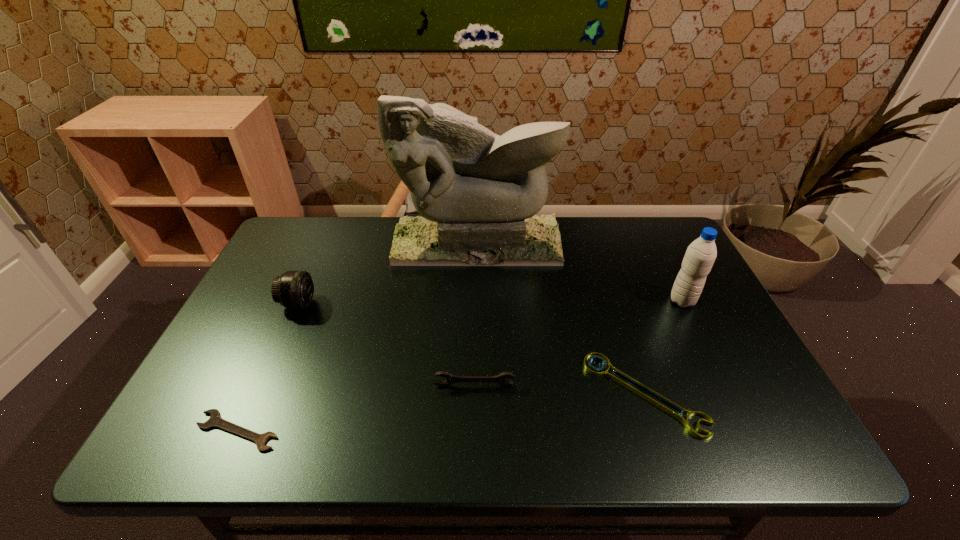
Where is `water bottle that is at the right edge`? This screenshot has height=540, width=960. water bottle that is at the right edge is located at coordinates (700, 255).

Image resolution: width=960 pixels, height=540 pixels. In order to click on wrench at the right edge in this screenshot , I will do `click(666, 405)`.

At what (x,y) coordinates should I click in order to perform the action: click on object that is at the near left corner. Please return your answer as a coordinate pair (x, y). Looking at the image, I should click on pyautogui.click(x=215, y=420).

At what (x,y) coordinates should I click in order to perform the action: click on object that is positioned at the near right corner. Please return your answer as a coordinate pair (x, y). The height and width of the screenshot is (540, 960). Looking at the image, I should click on (666, 405).

Locate an element on the screen. Image resolution: width=960 pixels, height=540 pixels. vacant space at the far edge is located at coordinates (564, 246).

Find the location of a particular element. Image resolution: width=960 pixels, height=540 pixels. vacant space at the left edge is located at coordinates (265, 373).

In the image, there is a desktop. Where is `vacant space at the far left corner`? The height and width of the screenshot is (540, 960). vacant space at the far left corner is located at coordinates (292, 238).

At what (x,y) coordinates should I click in order to perform the action: click on blank space at the near left corner. Please return your answer as a coordinate pair (x, y). This screenshot has width=960, height=540. Looking at the image, I should click on coord(178,448).

Image resolution: width=960 pixels, height=540 pixels. What are the coordinates of `blank area at the far right corner` in the screenshot? It's located at (682, 251).

Where is `blank region between the farthest object and the rightmost wrench`? Image resolution: width=960 pixels, height=540 pixels. blank region between the farthest object and the rightmost wrench is located at coordinates (561, 319).